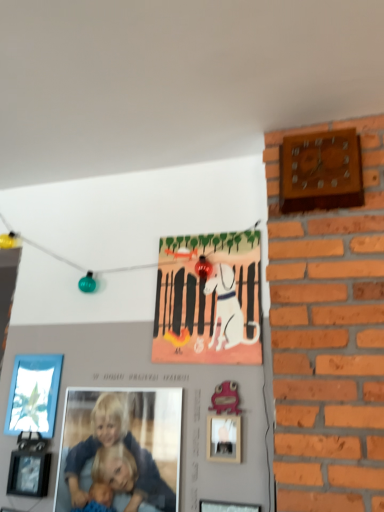
Question: From a real-world perspective, is matte glass picture frame at lower left, arranged as the 1th picture frame when viewed from the back, located higher than wooden wall clock at upper right?

Choices:
 (A) yes
 (B) no

Answer: (B)

Question: Can you confirm if matte glass picture frame at lower left, the first picture frame in the left-to-right sequence, is taller than wooden wall clock at upper right?

Choices:
 (A) no
 (B) yes

Answer: (A)

Question: Is matte glass picture frame at lower left, which is the fourth picture frame in front-to-back order, at the right side of wooden wall clock at upper right?

Choices:
 (A) yes
 (B) no

Answer: (B)

Question: From a real-world perspective, is matte glass picture frame at lower left, which is the fourth picture frame in front-to-back order, under wooden wall clock at upper right?

Choices:
 (A) yes
 (B) no

Answer: (A)

Question: From the image's perspective, is matte glass picture frame at lower left, the first picture frame in the left-to-right sequence, under wooden wall clock at upper right?

Choices:
 (A) no
 (B) yes

Answer: (B)

Question: Looking at their shapes, would you say wooden wall clock at upper right is wider or thinner than matte blue shirt at center?

Choices:
 (A) thin
 (B) wide

Answer: (B)

Question: Is point (347, 202) closer or farther from the camera than point (77, 500)?

Choices:
 (A) closer
 (B) farther

Answer: (A)

Question: Considering the relative positions of wooden wall clock at upper right and matte blue shirt at center in the image provided, is wooden wall clock at upper right to the left or to the right of matte blue shirt at center?

Choices:
 (A) left
 (B) right

Answer: (B)

Question: From a real-world perspective, relative to matte blue shirt at center, is wooden wall clock at upper right vertically above or below?

Choices:
 (A) below
 (B) above

Answer: (B)

Question: Is wooden picture frame at lower center, the fourth picture frame viewed from the back, wider or thinner than black matte picture frame at lower left, positioned as the 3th picture frame in right-to-left order?

Choices:
 (A) thin
 (B) wide

Answer: (A)

Question: Is wooden picture frame at lower center, the first picture frame from the front, inside or outside of black matte picture frame at lower left, the 2th picture frame positioned from the left?

Choices:
 (A) outside
 (B) inside

Answer: (A)

Question: Is wooden picture frame at lower center, arranged as the second picture frame when viewed from the right, bigger or smaller than black matte picture frame at lower left, which is the 2th picture frame from back to front?

Choices:
 (A) small
 (B) big

Answer: (A)

Question: Considering the relative positions of wooden picture frame at lower center, which is counted as the third picture frame, starting from the left, and black matte picture frame at lower left, which is the 2th picture frame from back to front, in the image provided, is wooden picture frame at lower center, which is counted as the third picture frame, starting from the left, to the left or to the right of black matte picture frame at lower left, which is the 2th picture frame from back to front,?

Choices:
 (A) right
 (B) left

Answer: (A)

Question: Relative to wooden picture frame at lower center, arranged as the second picture frame when viewed from the right, is wooden wall clock at upper right in front or behind?

Choices:
 (A) behind
 (B) front

Answer: (A)

Question: From a real-world perspective, relative to wooden picture frame at lower center, the fourth picture frame viewed from the back, is wooden wall clock at upper right vertically above or below?

Choices:
 (A) below
 (B) above

Answer: (B)